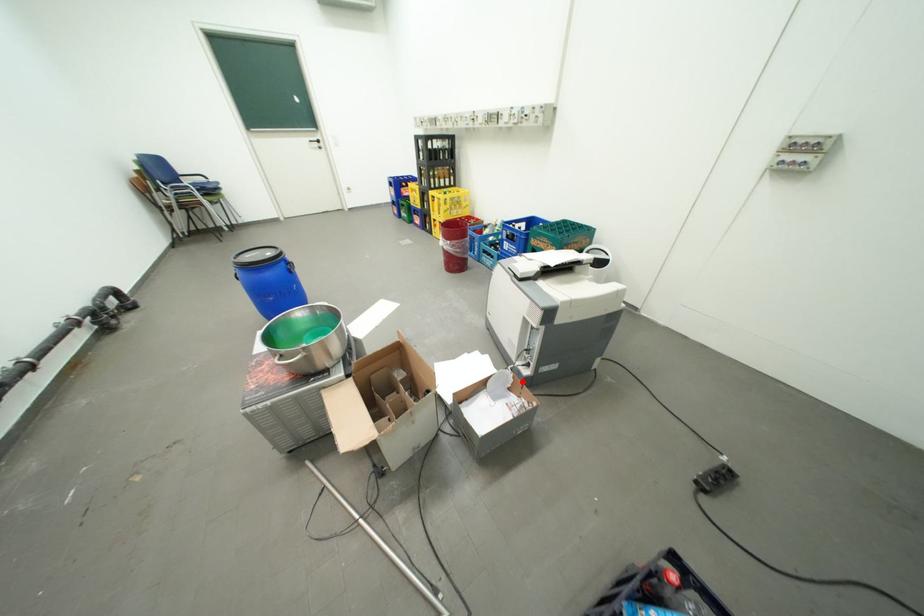
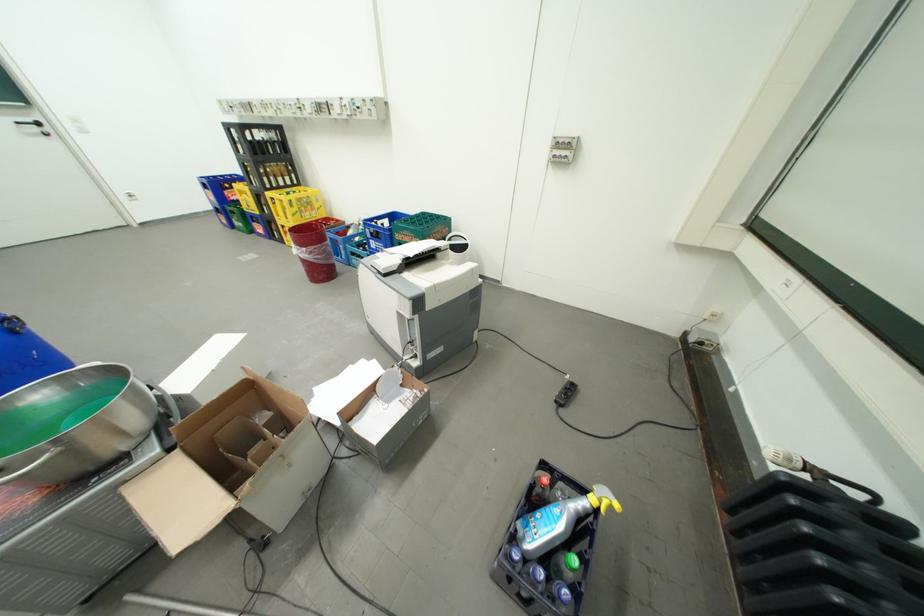
Question: A red point is marked in image1. In image2, is the corresponding 3D point closer to the camera or farther? Reply with the corresponding letter.

Choices:
 (A) The corresponding 3D point is closer.
 (B) The corresponding 3D point is farther.

Answer: (B)